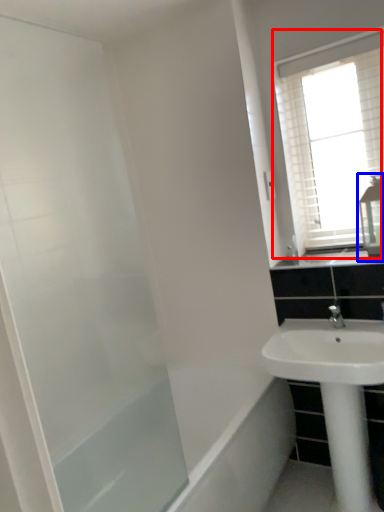
Question: Which object is further to the camera taking this photo, window (highlighted by a red box) or medicine cabinet (highlighted by a blue box)?

Choices:
 (A) window
 (B) medicine cabinet

Answer: (A)